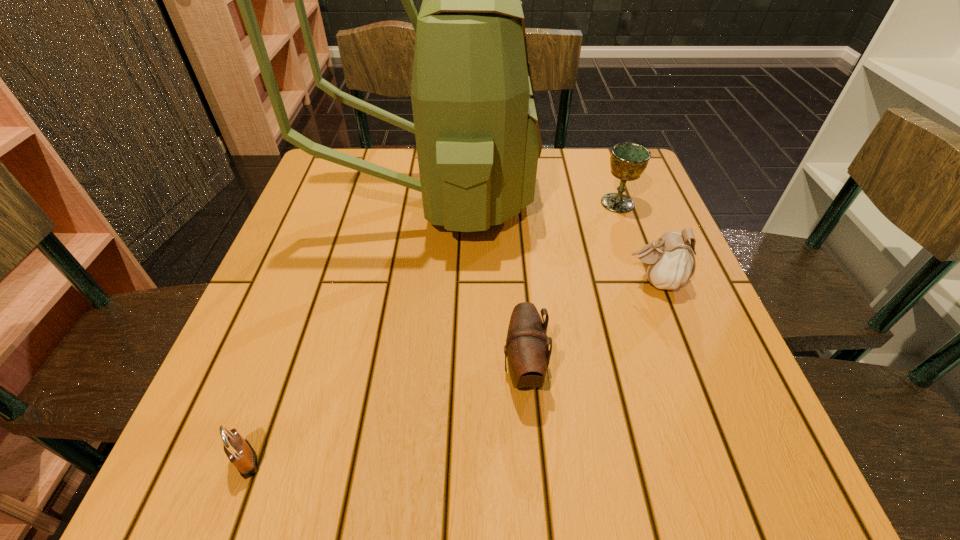
Image resolution: width=960 pixels, height=540 pixels. Identify the location of backpack. (476, 125).

Where is `chalice`? chalice is located at coordinates (628, 161).

Locate an element on the screen. This screenshot has width=960, height=540. the right pouch is located at coordinates (669, 262).

Where is `the farther pouch`? Image resolution: width=960 pixels, height=540 pixels. the farther pouch is located at coordinates (669, 262).

Where is `the fourth farthest object`? Image resolution: width=960 pixels, height=540 pixels. the fourth farthest object is located at coordinates (527, 351).

You are a GUI agent. You are given a task and a screenshot of the screen. Output one action in this format:
    pyautogui.click(x=<x>, y=<y>)
    Task: Click on the left pouch
    This screenshot has height=540, width=960.
    Given the screenshot: What is the action you would take?
    pyautogui.click(x=527, y=351)

Identify the location of the shortest object. (241, 454).

You are a GUI agent. You are given a task and a screenshot of the screen. Output one action in this format:
    pyautogui.click(x=<x>, y=<y>)
    Task: Click on the nearest object
    This screenshot has width=960, height=540.
    Given the screenshot: What is the action you would take?
    pyautogui.click(x=241, y=454)

Find the location of a particular element. vacant space located 0.160m on the front pocket of the backpack is located at coordinates (597, 199).

Locate an element on the screen. The image size is (960, 540). free space located 0.050m on the right of the chalice is located at coordinates (657, 203).